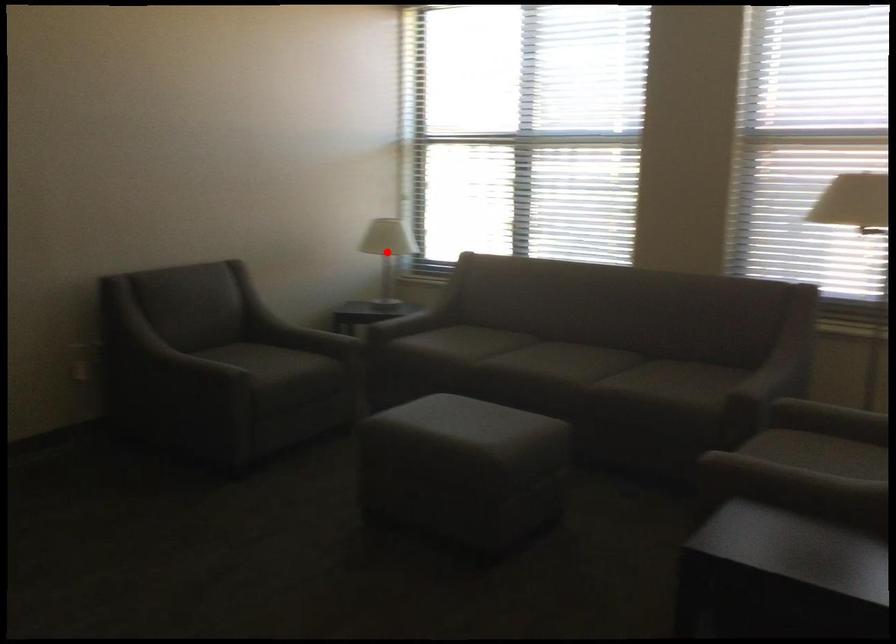
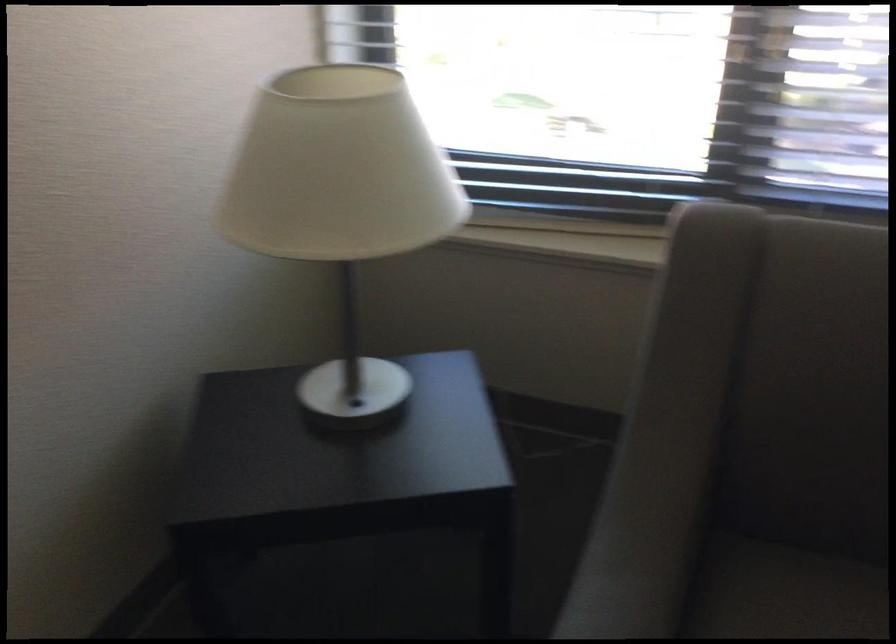
Question: I am providing you with two images of the same scene from different viewpoints. A red point is marked on the first image. Is the red point's position out of view in image 2?

Choices:
 (A) Yes
 (B) No

Answer: (A)